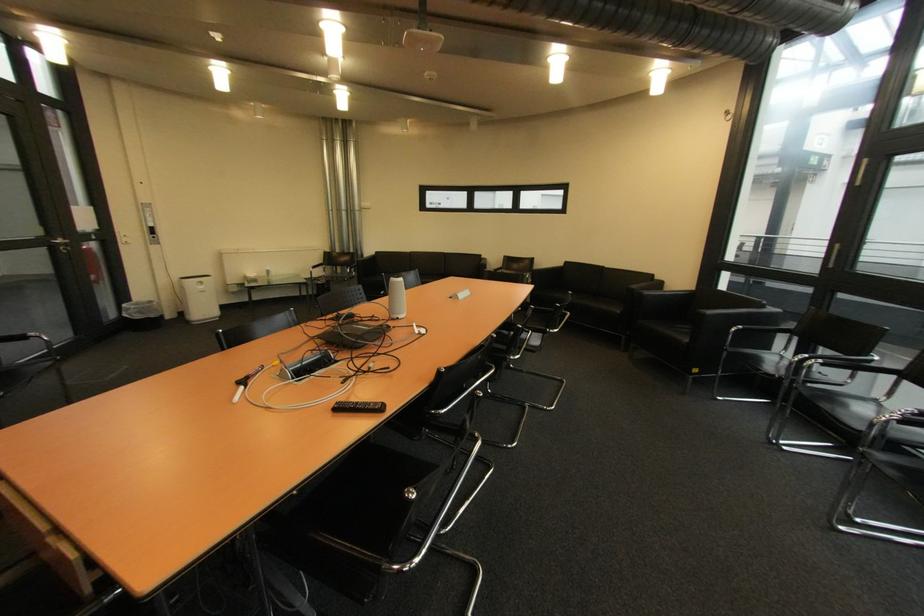
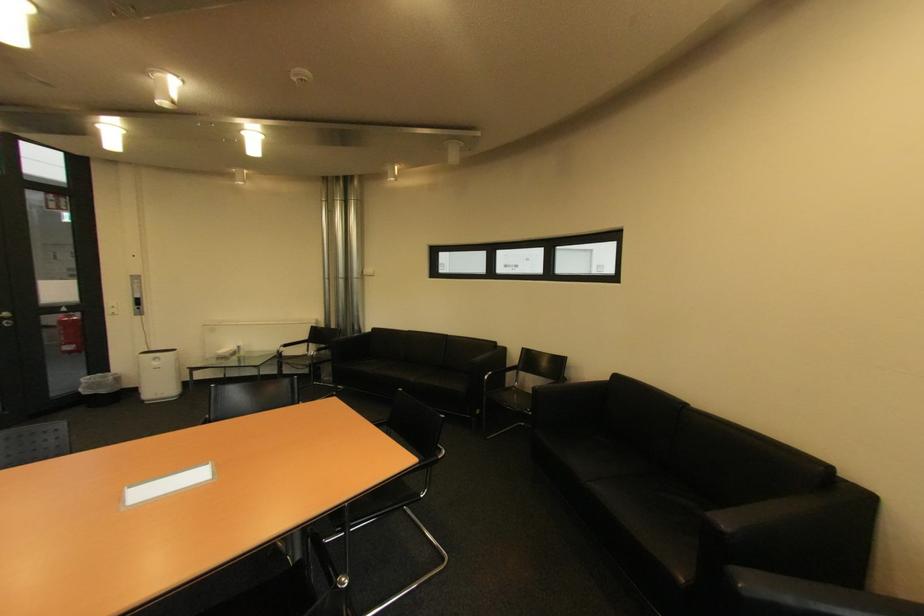
In the second image, find the point that corresponds to the point at 209,288 in the first image.

(164, 363)